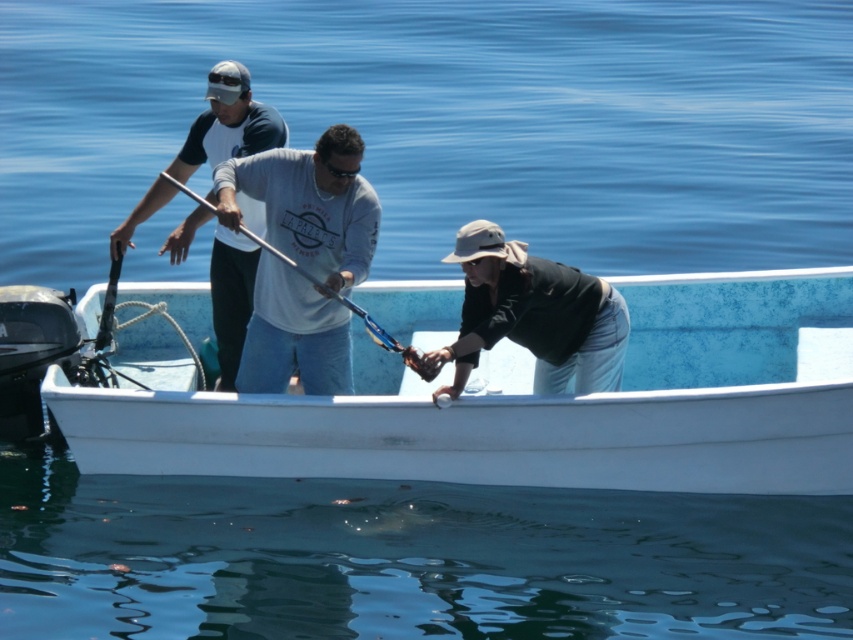
Question: Does white matte boat at center appear over matte white shirt at center?

Choices:
 (A) yes
 (B) no

Answer: (B)

Question: Which point is closer to the camera?

Choices:
 (A) (498, 282)
 (B) (241, 273)
 (C) (184, 189)

Answer: (A)

Question: Which point appears farthest from the camera in this image?

Choices:
 (A) (271, 248)
 (B) (469, 316)
 (C) (223, 387)
 (D) (743, 410)

Answer: (C)

Question: Can you confirm if white matte boat at center is smaller than khaki fabric hat at center?

Choices:
 (A) no
 (B) yes

Answer: (A)

Question: Considering the real-world distances, which object is closest to the metallic blue paddle at center?

Choices:
 (A) khaki fabric hat at center
 (B) white matte boat at center

Answer: (A)

Question: From the image, what is the correct spatial relationship of matte white shirt at center in relation to metallic blue paddle at center?

Choices:
 (A) left
 (B) right

Answer: (A)